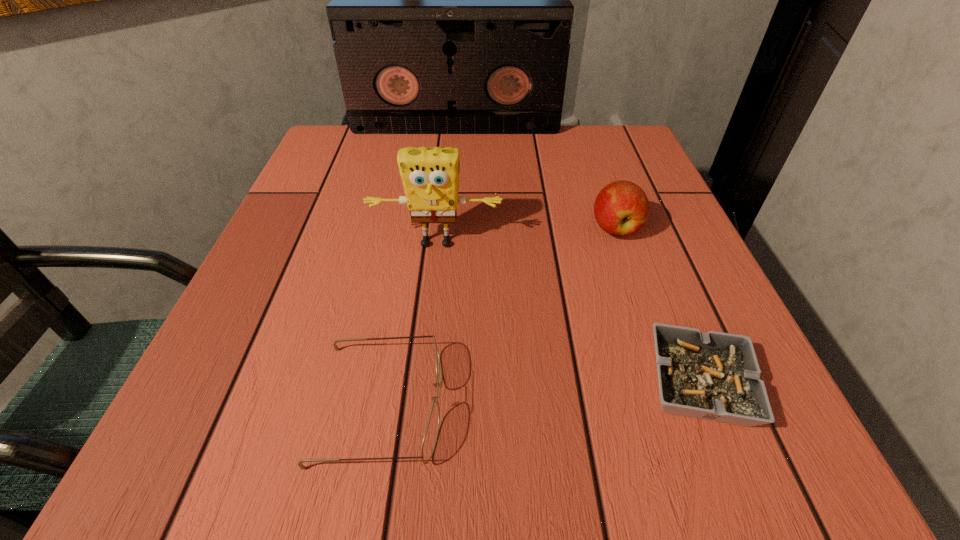
Where is `unoccupied position between the ashtray and the sponge`? unoccupied position between the ashtray and the sponge is located at coordinates (567, 314).

Identify the location of free space that is in between the tallest object and the shortest object. Image resolution: width=960 pixels, height=540 pixels. (577, 256).

In order to click on free space between the fourth shortest object and the fourth tallest object in this screenshot , I will do `click(409, 324)`.

The height and width of the screenshot is (540, 960). Identify the location of unoccupied position between the apple and the sponge. (525, 236).

At what (x,y) coordinates should I click in order to perform the action: click on object that is the fourth closest to the third tallest object. Please return your answer as a coordinate pair (x, y). Looking at the image, I should click on (429, 442).

Locate an element on the screen. The image size is (960, 540). object that is the third closest to the apple is located at coordinates (451, 13).

Find the location of a particular element. This screenshot has height=540, width=960. vacant point that satisfies the following two spatial constraints: 1. on the front side of the third shortest object; 2. on the right side of the videotape is located at coordinates (447, 228).

The image size is (960, 540). In order to click on vacant area in the image that satisfies the following two spatial constraints: 1. on the front side of the videotape; 2. on the right side of the third shortest object in this screenshot , I will do `click(447, 228)`.

Locate an element on the screen. The height and width of the screenshot is (540, 960). free location that satisfies the following two spatial constraints: 1. on the front side of the apple; 2. on the front-facing side of the spectacles is located at coordinates (676, 404).

Image resolution: width=960 pixels, height=540 pixels. I want to click on free space that satisfies the following two spatial constraints: 1. on the front side of the third tallest object; 2. on the front-facing side of the spectacles, so click(x=676, y=404).